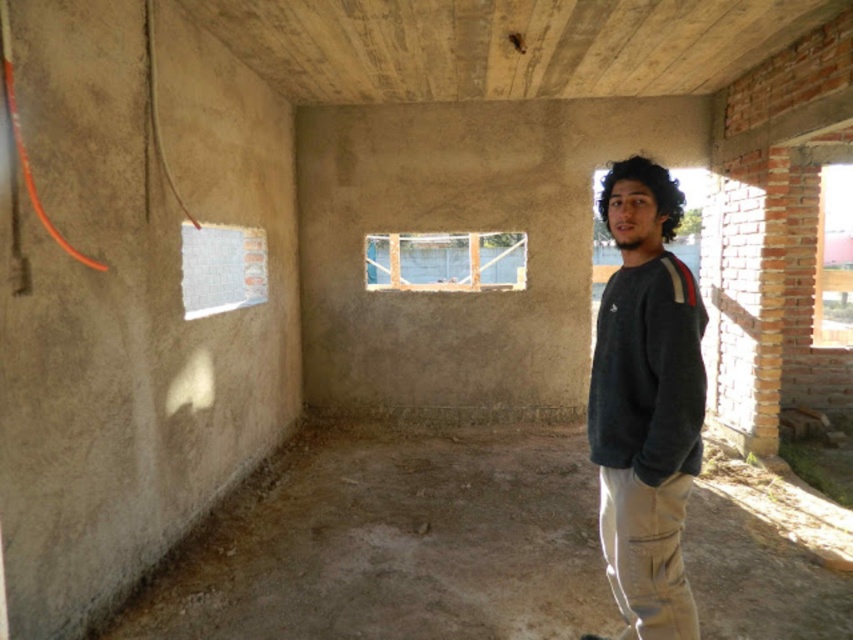
Based on the photo, you are a construction worker standing at the entrance of the room. You need to place a tool box that is 1.5 meters long on the floor. The dark gray sweater at center is in your way. Can you move the tool box around it without moving the sweater?

The dark gray sweater at center is 2.02 meters away from the camera. Since the tool box is 1.5 meters long, you can move it around the sweater as the distance allows enough space to maneuver around it.

You are a construction worker who needs to move a tool from the dark gray sweater at center to the khaki pants at lower right. Can you do this without moving the sweater or pants?

The dark gray sweater at center is 6.85 inches away from the khaki pants at lower right, so yes, you can move the tool between them since the distance is sufficient.

From the picture: You are a construction worker in the unfinished space. You see the khaki pants at lower right and the dark curly hair at upper right. Which object is smaller in size?

The khaki pants at lower right is smaller than the dark curly hair at upper right according to the description.